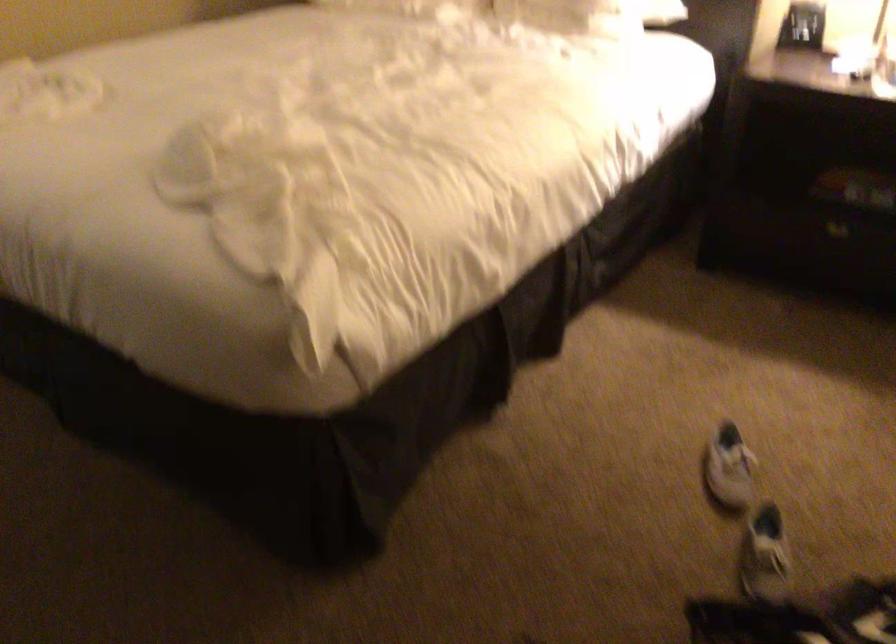
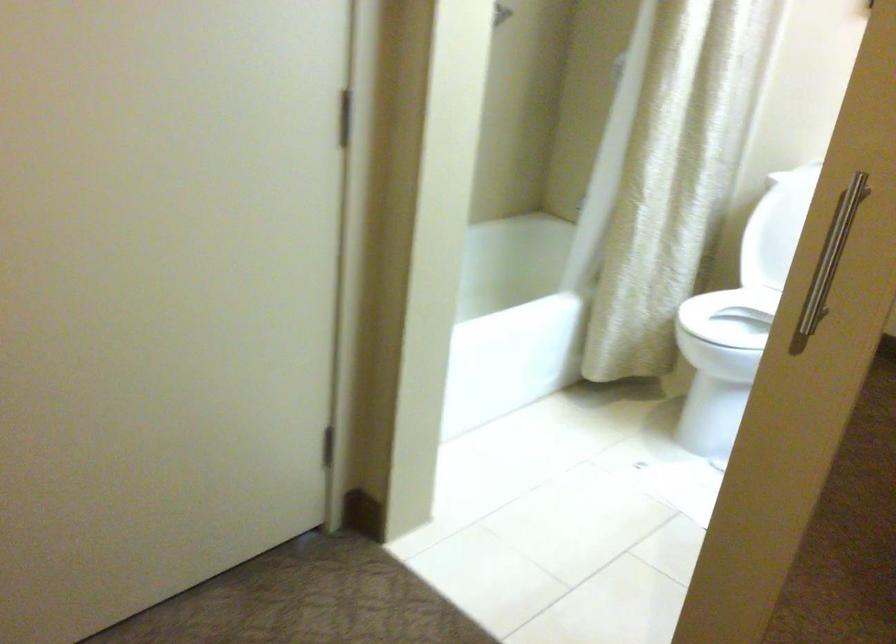
Consider the image. The images are taken continuously from a first-person perspective. In which direction are you moving?

The movement direction of the cameraman is left, forward.